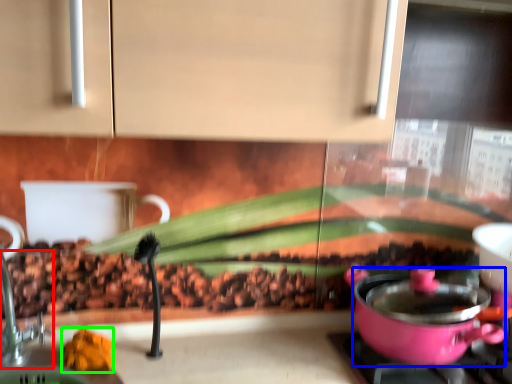
Question: Which object is positioned closest to faucet (highlighted by a red box)? Select from kitchen appliance (highlighted by a blue box) and food (highlighted by a green box).

Choices:
 (A) kitchen appliance
 (B) food

Answer: (B)